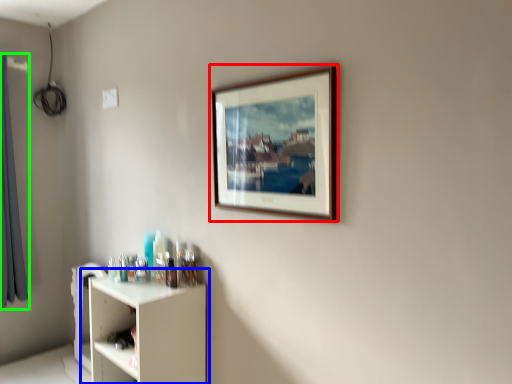
Question: Based on their relative distances, which object is farther from picture frame (highlighted by a red box)? Choose from shelf (highlighted by a blue box) and curtain (highlighted by a green box).

Choices:
 (A) shelf
 (B) curtain

Answer: (B)